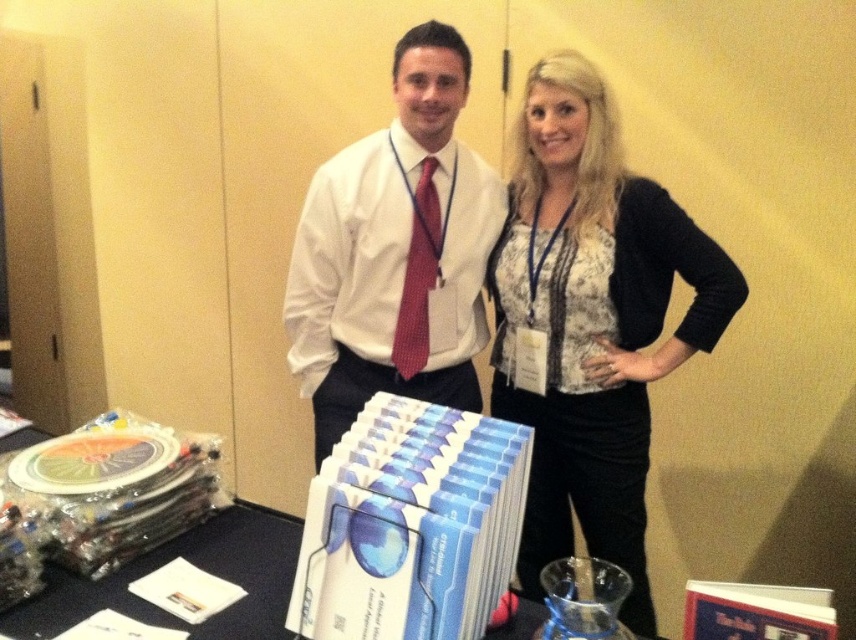
You are organizing a photoshoot and need to ensure proper lighting for both the white lace blouse at center and the white shirt at center. Since they are both white, you want to make sure their positions relative to each other are clear in the photo. Based on the scene description, which of the two items is positioned lower in the image?

The white lace blouse at center is located below the white shirt at center, so it is positioned lower in the image.

You are organizing a photo shoot and need to ensure that the white lace blouse at center and the white shirt at center are both visible in the frame. Given their sizes, which one should you adjust the camera focus on to ensure both are in focus?

Since the white lace blouse at center is much taller than the white shirt at center, you should adjust the camera focus on the taller white lace blouse at center to ensure both are in focus.

You are standing at the back of the room and want to pick up the white lace blouse at center from the table. The table is 2 meters away from you. Can you reach it without moving closer?

The white lace blouse at center is 1.61 meters away from the camera, so if the table is 2 meters away from you, the blouse is further away than your reach. You need to move closer to reach it.